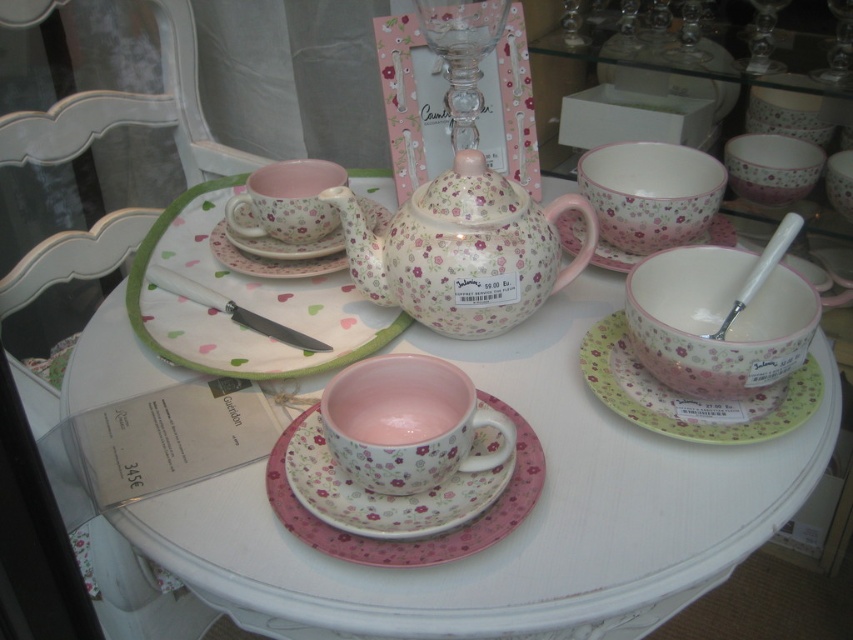
Can you confirm if pink fabric placemat at center is positioned below matte ceramic cup at center?

No.

Is pink fabric placemat at center behind matte ceramic cup at center?

Yes, pink fabric placemat at center is further from the viewer.

You are a GUI agent. You are given a task and a screenshot of the screen. Output one action in this format:
    pyautogui.click(x=<x>, y=<y>)
    Task: Click on the pink fabric placemat at center
    The image size is (853, 640).
    Given the screenshot: What is the action you would take?
    pyautogui.click(x=242, y=301)

Locate an element on the screen. pink glossy teacup at center is located at coordinates (407, 422).

Who is shorter, pink glossy teacup at center or pink matte saucer at center?

With less height is pink glossy teacup at center.

Locate an element on the screen. Image resolution: width=853 pixels, height=640 pixels. pink glossy teacup at center is located at coordinates (407, 422).

Can you confirm if matte ceramic table at center is positioned below pink floral porcelain teacup at center?

Correct, matte ceramic table at center is located below pink floral porcelain teacup at center.

Identify the location of matte ceramic table at center. The height and width of the screenshot is (640, 853). (523, 522).

Where is `matte ceramic table at center`? matte ceramic table at center is located at coordinates (523, 522).